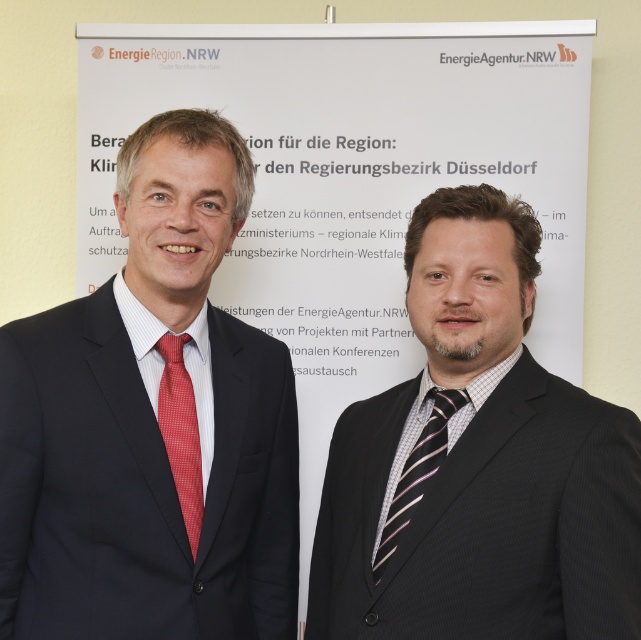
Question: Which object is positioned closest to the matte black suit at left?

Choices:
 (A) striped silk tie at right
 (B) striped fabric suit at right

Answer: (B)

Question: Which object is the farthest from the matte black suit at left?

Choices:
 (A) striped fabric suit at right
 (B) red checkered tie at left

Answer: (A)

Question: Does matte black suit at left come in front of striped fabric suit at right?

Choices:
 (A) yes
 (B) no

Answer: (B)

Question: Where is matte black suit at left located in relation to striped silk tie at right in the image?

Choices:
 (A) right
 (B) left

Answer: (B)

Question: Which of the following is the closest to the observer?

Choices:
 (A) striped fabric suit at right
 (B) striped silk tie at right
 (C) matte black suit at left

Answer: (A)

Question: Considering the relative positions of striped fabric suit at right and red checkered tie at left in the image provided, where is striped fabric suit at right located with respect to red checkered tie at left?

Choices:
 (A) above
 (B) below

Answer: (A)